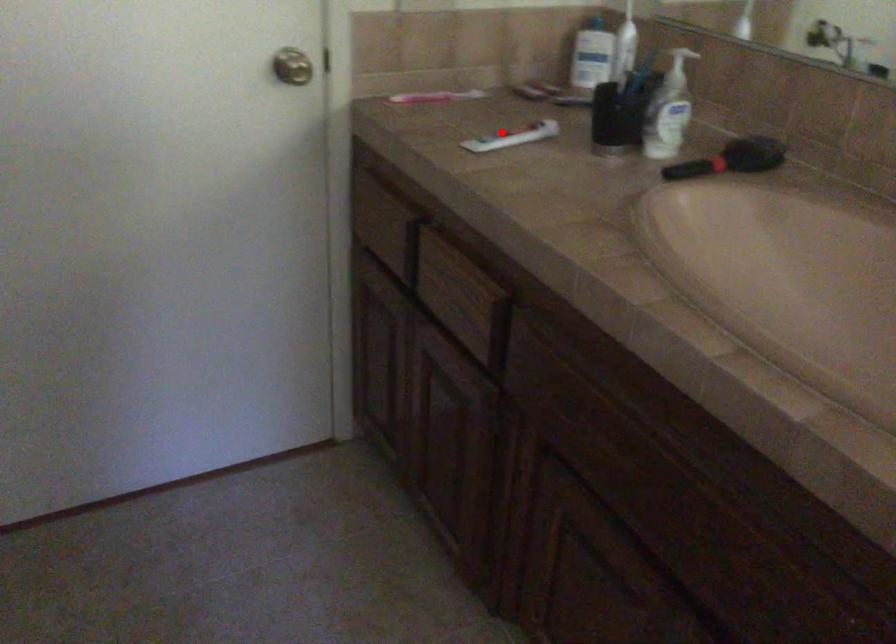
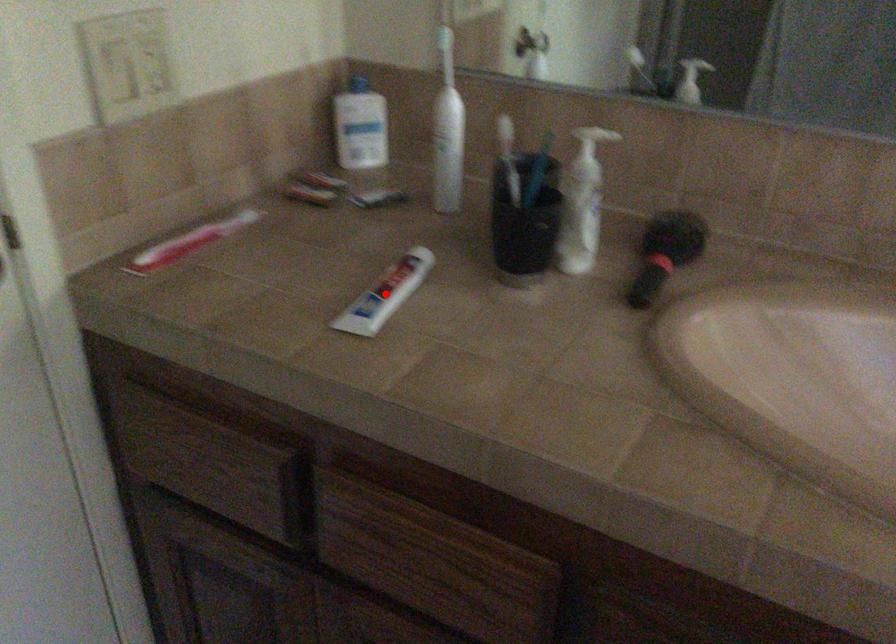
I am providing you with two images of the same scene from different viewpoints. A red point is marked on the first image and another point is marked on the second image. Do the highlighted points in image1 and image2 indicate the same real-world spot?

Yes